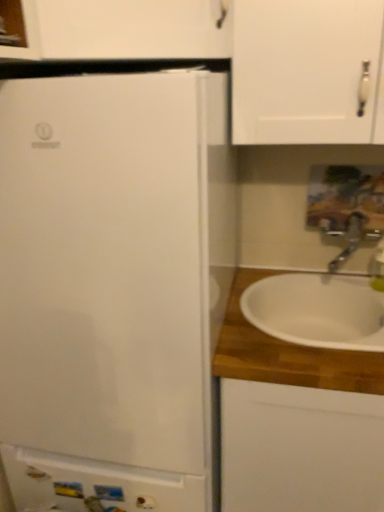
Question: Is white wood cabinet at right, which is the second cabinetry from left to right, at the right side of satin nickel faucet at right?

Choices:
 (A) yes
 (B) no

Answer: (B)

Question: Does white wood cabinet at right, positioned as the 1th cabinetry in right-to-left order, have a greater height compared to satin nickel faucet at right?

Choices:
 (A) no
 (B) yes

Answer: (B)

Question: Is white wood cabinet at right, positioned as the 1th cabinetry in right-to-left order, to the left of satin nickel faucet at right from the viewer's perspective?

Choices:
 (A) yes
 (B) no

Answer: (A)

Question: Is white wood cabinet at right, positioned as the 1th cabinetry in right-to-left order, oriented towards satin nickel faucet at right?

Choices:
 (A) yes
 (B) no

Answer: (B)

Question: Is white wood cabinet at right, positioned as the 1th cabinetry in right-to-left order, surrounding satin nickel faucet at right?

Choices:
 (A) no
 (B) yes

Answer: (A)

Question: Looking at their shapes, would you say white ceramic sink at right is wider or thinner than satin nickel faucet at right?

Choices:
 (A) wide
 (B) thin

Answer: (A)

Question: In the image, is white ceramic sink at right on the left side or the right side of satin nickel faucet at right?

Choices:
 (A) left
 (B) right

Answer: (A)

Question: Is white ceramic sink at right taller or shorter than satin nickel faucet at right?

Choices:
 (A) tall
 (B) short

Answer: (B)

Question: Based on their sizes in the image, would you say white ceramic sink at right is bigger or smaller than satin nickel faucet at right?

Choices:
 (A) big
 (B) small

Answer: (A)

Question: From a real-world perspective, is satin nickel faucet at right physically located above or below white glossy cabinet at lower left, placed as the 2th cabinetry when sorted from right to left?

Choices:
 (A) above
 (B) below

Answer: (A)

Question: Is satin nickel faucet at right bigger or smaller than white glossy cabinet at lower left, the first cabinetry from the left?

Choices:
 (A) big
 (B) small

Answer: (A)

Question: Is satin nickel faucet at right situated inside white glossy cabinet at lower left, placed as the 2th cabinetry when sorted from right to left, or outside?

Choices:
 (A) inside
 (B) outside

Answer: (B)

Question: Is satin nickel faucet at right wider or thinner than white glossy cabinet at lower left, the first cabinetry from the left?

Choices:
 (A) thin
 (B) wide

Answer: (B)

Question: Is white wood cabinet at right, positioned as the 1th cabinetry in right-to-left order, situated inside satin nickel faucet at right or outside?

Choices:
 (A) inside
 (B) outside

Answer: (B)

Question: In the image, is white wood cabinet at right, which is the second cabinetry from left to right, on the left side or the right side of satin nickel faucet at right?

Choices:
 (A) left
 (B) right

Answer: (A)